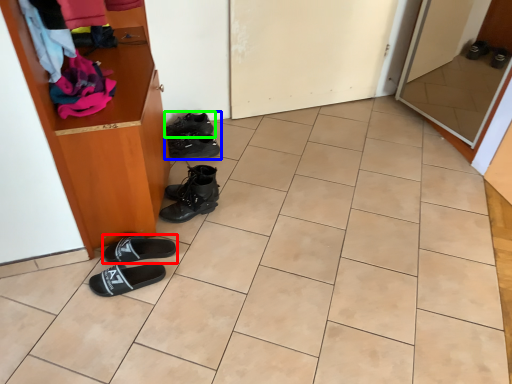
Question: Based on their relative distances, which object is farther from footwear (highlighted by a red box)? Choose from footwear (highlighted by a blue box) and footwear (highlighted by a green box).

Choices:
 (A) footwear
 (B) footwear

Answer: (B)